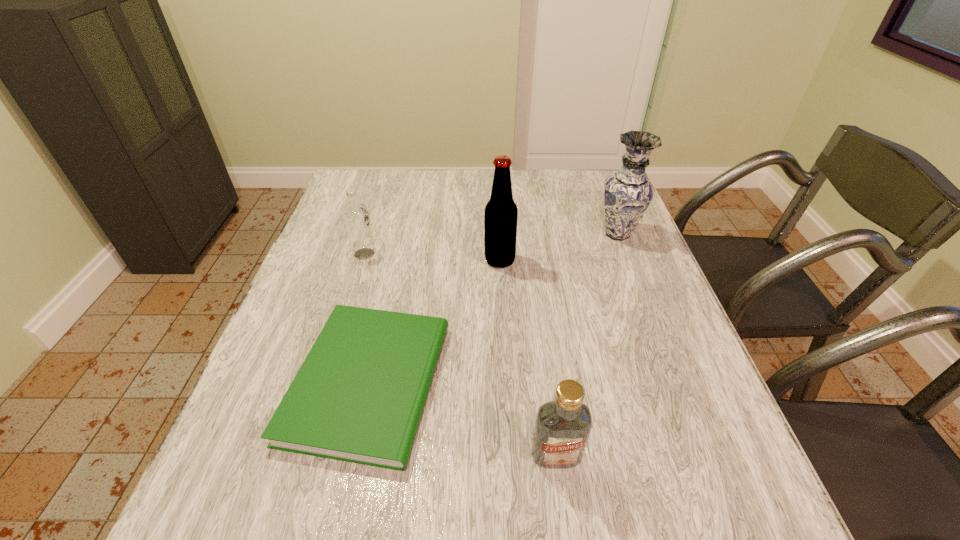
The image size is (960, 540). I want to click on beer bottle, so click(501, 213).

Image resolution: width=960 pixels, height=540 pixels. I want to click on vase, so click(628, 192).

This screenshot has height=540, width=960. In order to click on the farther vodka in this screenshot , I will do `click(356, 217)`.

I want to click on the nearer vodka, so click(562, 429).

You are a GUI agent. You are given a task and a screenshot of the screen. Output one action in this format:
    pyautogui.click(x=<x>, y=<y>)
    Task: Click on the shortest object
    
    Given the screenshot: What is the action you would take?
    pyautogui.click(x=359, y=396)

You are a GUI agent. You are given a task and a screenshot of the screen. Output one action in this format:
    pyautogui.click(x=<x>, y=<y>)
    Task: Click on the free spot located 0.130m on the front of the beer bottle
    Image resolution: width=960 pixels, height=540 pixels.
    Given the screenshot: What is the action you would take?
    pyautogui.click(x=502, y=307)

The image size is (960, 540). Find the location of `free space located on the back of the rightmost object`. free space located on the back of the rightmost object is located at coordinates (606, 205).

Where is `vacant space located on the front label of the left vodka`? The height and width of the screenshot is (540, 960). vacant space located on the front label of the left vodka is located at coordinates click(x=420, y=254).

Find the location of `blank space located 0.070m on the front-facing side of the nearer vodka`. blank space located 0.070m on the front-facing side of the nearer vodka is located at coordinates (564, 514).

Locate an element on the screen. vacant space located on the back of the shortest object is located at coordinates (395, 265).